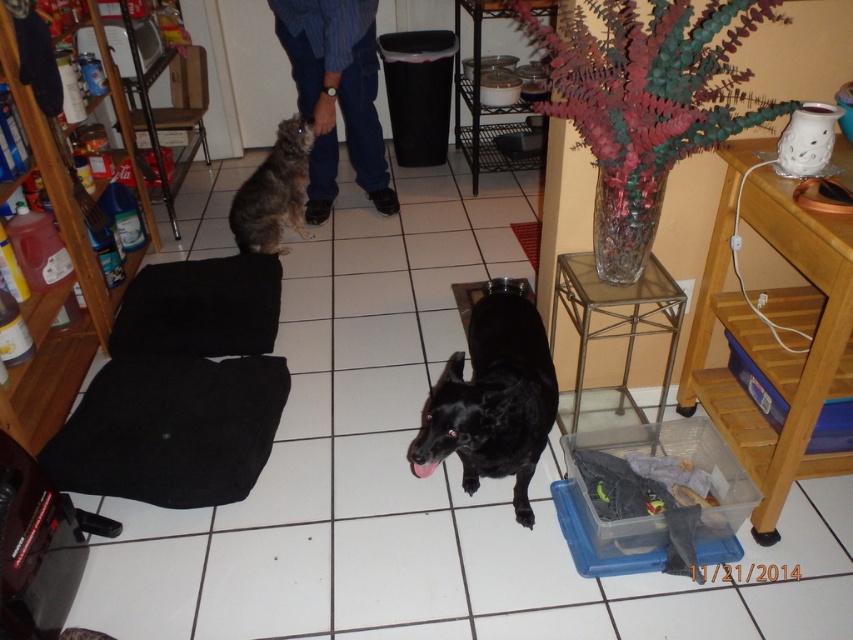
You are standing in the kitchen and want to take a photo of the black matte dog at center. If your camera has a minimum focus distance of 5 feet, will you need to move closer or farther away to capture a clear photo?

The black matte dog at center is 4.76 feet away from the camera. Since the minimum focus distance is 5 feet, you need to move slightly farther away to ensure the camera can focus properly.

You are trying to find the fuzzy brown cat at upper left in the image. Where would you look relative to the blue denim jeans at center?

The blue denim jeans at center is positioned over the fuzzy brown cat at upper left, so the fuzzy brown cat at upper left is underneath the blue denim jeans at center.

You are trying to place a new item in the kitchen. The black matte dog at center is currently sitting at point 0.627, 0.578. Where exactly should you place the item to avoid stepping on the dog?

The black matte dog at center is located at point (492, 401), so you should place the new item in an area that does not overlap with these coordinates to avoid stepping on the dog.